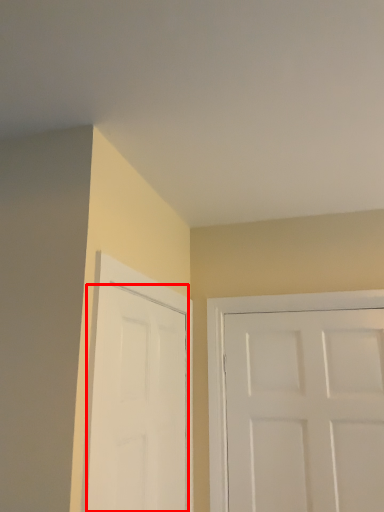
Question: From the image's perspective, considering the relative positions of door (annotated by the red box) and door in the image provided, where is door (annotated by the red box) located with respect to the staircase?

Choices:
 (A) below
 (B) above

Answer: (B)